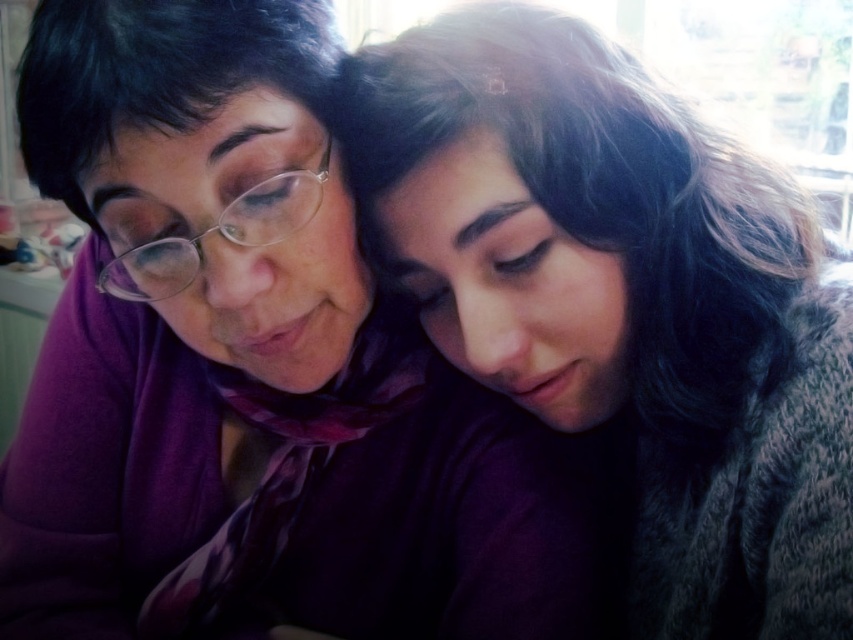
Does dark purple scarf at center have a lesser width compared to clear plastic glasses at upper left?

No.

Is point (669, 385) farther from camera compared to point (305, 188)?

Yes.

Who is more forward, (701, 593) or (183, 285)?

Point (183, 285) is in front.

I want to click on dark purple scarf at center, so click(624, 300).

Is matte purple scarf at upper center taller than clear plastic glasses at upper left?

Yes.

Is matte purple scarf at upper center further to the viewer compared to clear plastic glasses at upper left?

That is False.

Between point (361, 522) and point (175, 236), which one is positioned behind?

Positioned behind is point (361, 522).

Where is `matte purple scarf at upper center`? Image resolution: width=853 pixels, height=640 pixels. matte purple scarf at upper center is located at coordinates (250, 365).

Can you confirm if matte purple scarf at upper center is positioned below dark purple scarf at center?

Indeed, matte purple scarf at upper center is positioned under dark purple scarf at center.

You are a GUI agent. You are given a task and a screenshot of the screen. Output one action in this format:
    pyautogui.click(x=<x>, y=<y>)
    Task: Click on the matte purple scarf at upper center
    This screenshot has height=640, width=853.
    Given the screenshot: What is the action you would take?
    pyautogui.click(x=250, y=365)